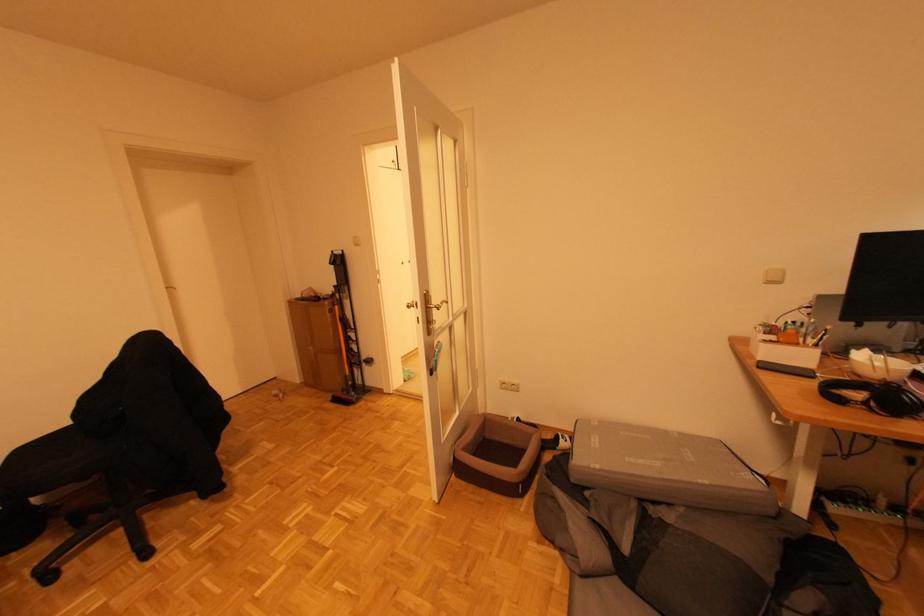
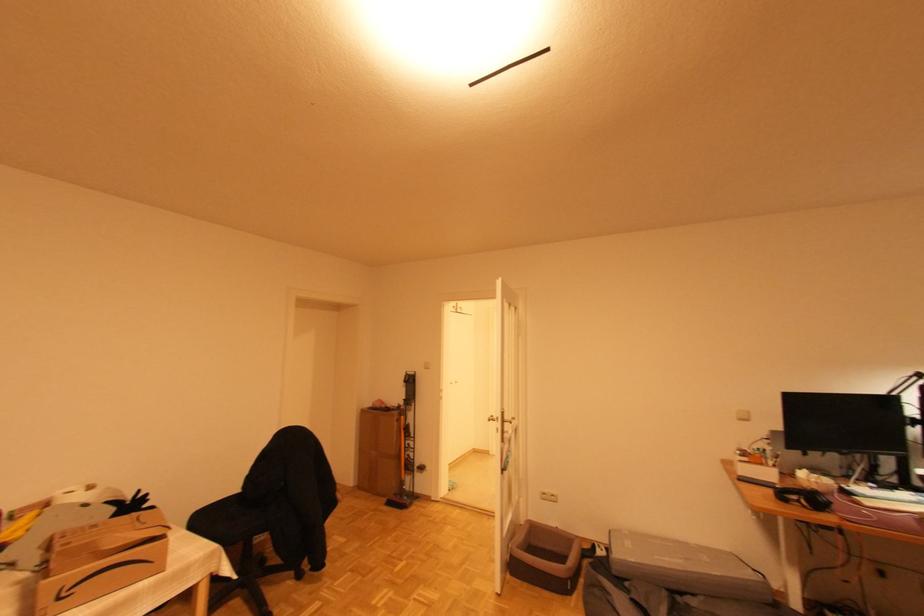
The point at (x=335, y=296) is marked in the first image. Where is the corresponding point in the second image?

(402, 407)